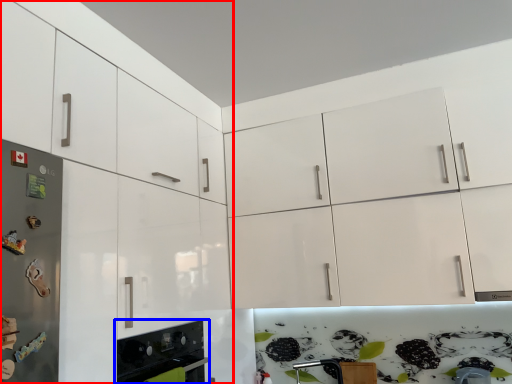
Question: Among these objects, which one is nearest to the camera, cabinetry (highlighted by a red box) or home appliance (highlighted by a blue box)?

Choices:
 (A) cabinetry
 (B) home appliance

Answer: (A)